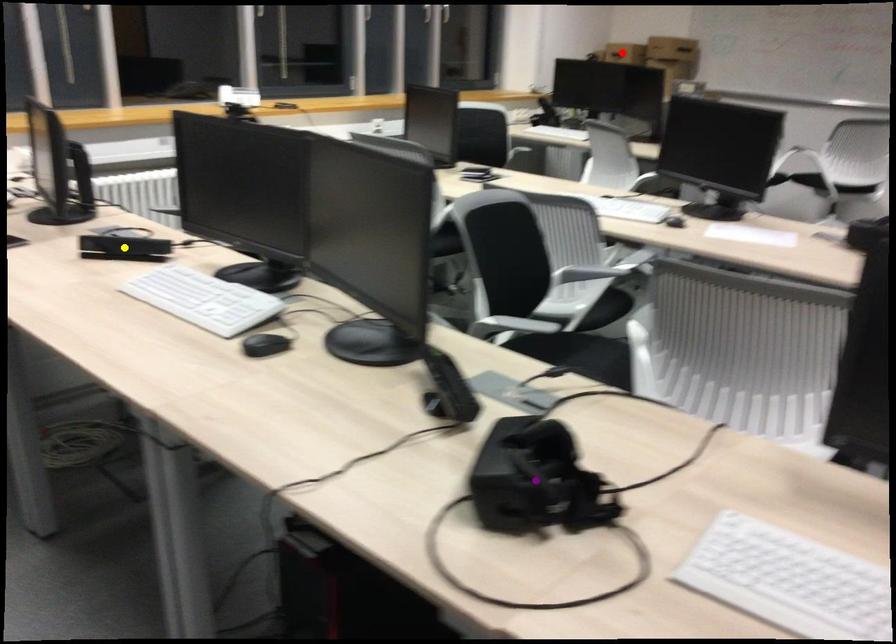
Order these from farthest to nearest:
A) red point
B) purple point
C) yellow point

red point < yellow point < purple point